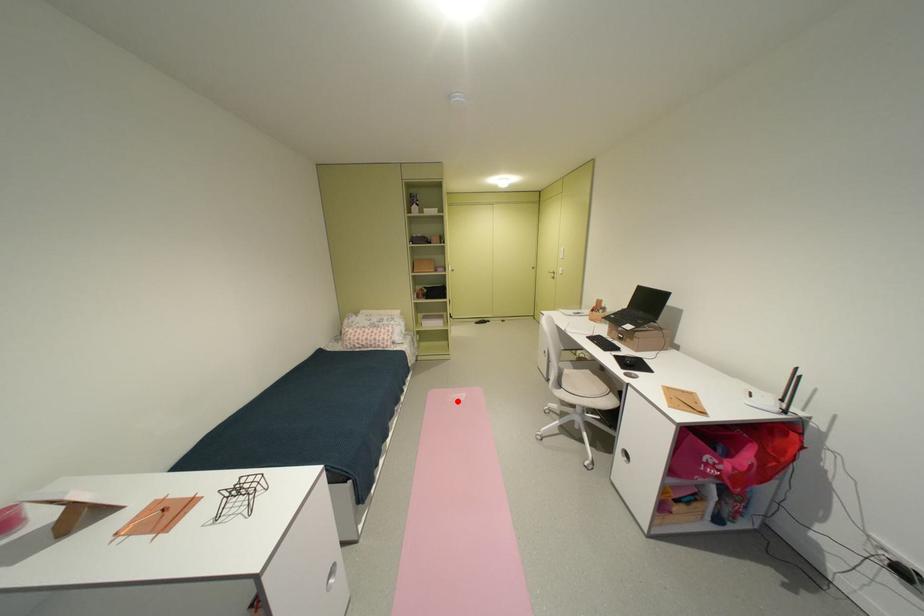
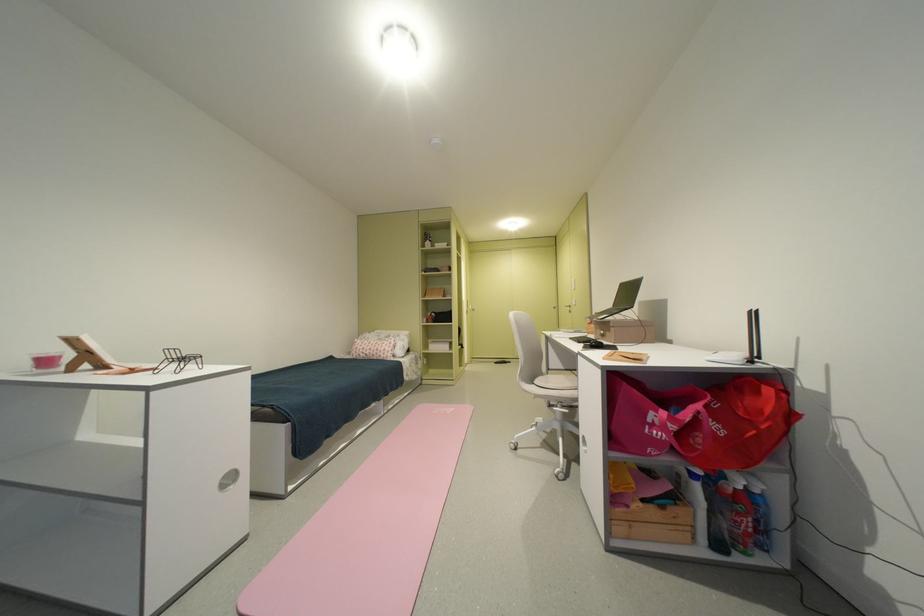
Question: A red point is marked in image1. In image2, is the corresponding 3D point closer to the camera or farther? Reply with the corresponding letter.

Choices:
 (A) The corresponding 3D point is closer.
 (B) The corresponding 3D point is farther.

Answer: (B)